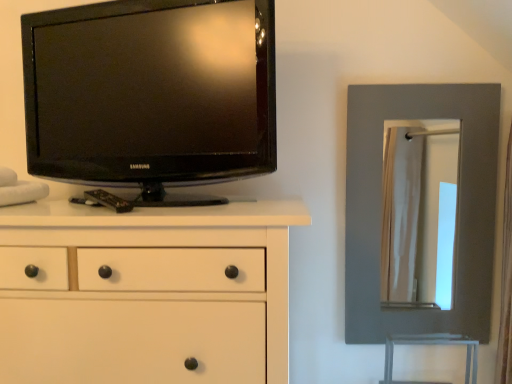
Question: Can you confirm if matte gray mirror at right is thinner than black glossy tv at upper left?

Choices:
 (A) no
 (B) yes

Answer: (B)

Question: Is matte gray mirror at right shorter than black glossy tv at upper left?

Choices:
 (A) no
 (B) yes

Answer: (A)

Question: Is matte gray mirror at right facing towards black glossy tv at upper left?

Choices:
 (A) yes
 (B) no

Answer: (B)

Question: Considering the relative sizes of matte gray mirror at right and black glossy tv at upper left in the image provided, is matte gray mirror at right taller than black glossy tv at upper left?

Choices:
 (A) no
 (B) yes

Answer: (B)

Question: Does matte gray mirror at right lie behind black glossy tv at upper left?

Choices:
 (A) yes
 (B) no

Answer: (A)

Question: Is black glossy tv at upper left spatially inside matte gray mirror at right, or outside of it?

Choices:
 (A) outside
 (B) inside

Answer: (A)

Question: From a real-world perspective, is black glossy tv at upper left physically located above or below matte gray mirror at right?

Choices:
 (A) above
 (B) below

Answer: (A)

Question: Relative to matte gray mirror at right, is black glossy tv at upper left in front or behind?

Choices:
 (A) behind
 (B) front

Answer: (B)

Question: Considering the relative positions of black glossy tv at upper left and matte gray mirror at right in the image provided, is black glossy tv at upper left to the left or to the right of matte gray mirror at right?

Choices:
 (A) left
 (B) right

Answer: (A)

Question: Is point (24, 271) positioned closer to the camera than point (495, 178)?

Choices:
 (A) closer
 (B) farther

Answer: (A)

Question: Considering the positions of white matte chest of drawers at left and matte gray mirror at right in the image, is white matte chest of drawers at left taller or shorter than matte gray mirror at right?

Choices:
 (A) tall
 (B) short

Answer: (B)

Question: From the image's perspective, is white matte chest of drawers at left positioned above or below matte gray mirror at right?

Choices:
 (A) below
 (B) above

Answer: (A)

Question: Visually, is white matte chest of drawers at left positioned to the left or to the right of matte gray mirror at right?

Choices:
 (A) right
 (B) left

Answer: (B)

Question: Visually, is matte gray mirror at right positioned to the left or to the right of white matte chest of drawers at left?

Choices:
 (A) left
 (B) right

Answer: (B)

Question: Is matte gray mirror at right situated inside white matte chest of drawers at left or outside?

Choices:
 (A) outside
 (B) inside

Answer: (A)